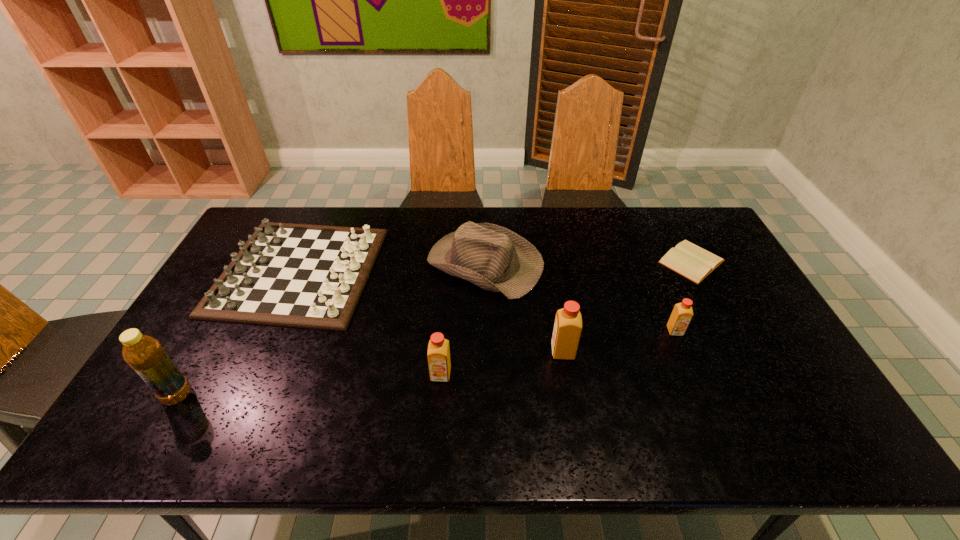
This screenshot has width=960, height=540. Identify the location of the second shortest orange juice. (438, 349).

In order to click on the leftmost orange juice in this screenshot , I will do `click(438, 349)`.

The width and height of the screenshot is (960, 540). What are the coordinates of `the second orange juice from right to left` in the screenshot? It's located at (568, 326).

What are the coordinates of `the third nearest object` in the screenshot? It's located at (568, 326).

The image size is (960, 540). I want to click on the fifth tallest object, so [682, 313].

You are a GUI agent. You are given a task and a screenshot of the screen. Output one action in this format:
    pyautogui.click(x=<x>, y=<y>)
    Task: Click on the sixth object from left to right
    Image resolution: width=960 pixels, height=540 pixels.
    Given the screenshot: What is the action you would take?
    pyautogui.click(x=682, y=313)

Where is `chessboard`? The height and width of the screenshot is (540, 960). chessboard is located at coordinates (294, 275).

You are a GUI agent. You are given a task and a screenshot of the screen. Output one action in this format:
    pyautogui.click(x=<x>, y=<y>)
    Task: Click on the fedora
    This screenshot has width=960, height=540.
    Given the screenshot: What is the action you would take?
    pyautogui.click(x=496, y=259)

Locate an element on the screen. Image resolution: width=960 pixels, height=540 pixels. the rightmost object is located at coordinates point(689,260).

Find the location of a particular element. diary is located at coordinates (689, 260).